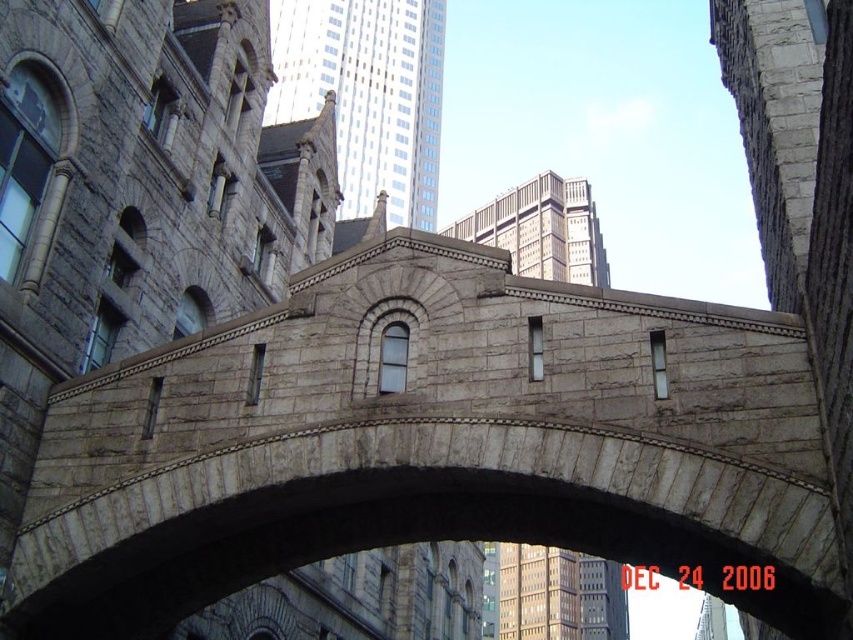
Does smooth gray stone tower at upper center have a greater width compared to gray stone tower at upper center?

No, smooth gray stone tower at upper center is not wider than gray stone tower at upper center.

Who is higher up, smooth gray stone tower at upper center or gray stone tower at upper center?

smooth gray stone tower at upper center is above.

The image size is (853, 640). What do you see at coordinates (367, 93) in the screenshot?
I see `smooth gray stone tower at upper center` at bounding box center [367, 93].

The height and width of the screenshot is (640, 853). I want to click on smooth gray stone tower at upper center, so click(367, 93).